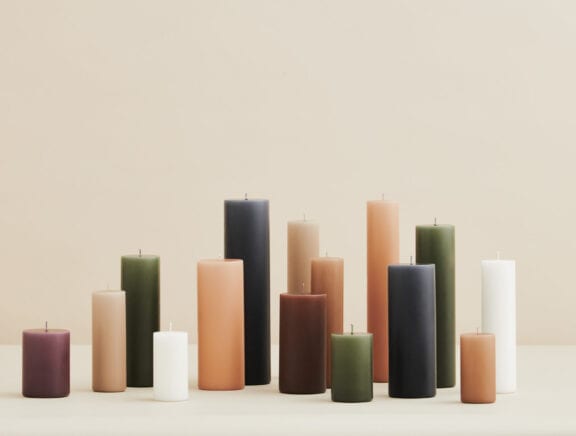
Find the location of a particular element. The height and width of the screenshot is (436, 576). beige candles is located at coordinates (107, 349), (227, 304), (295, 241), (321, 269), (378, 228), (476, 346).